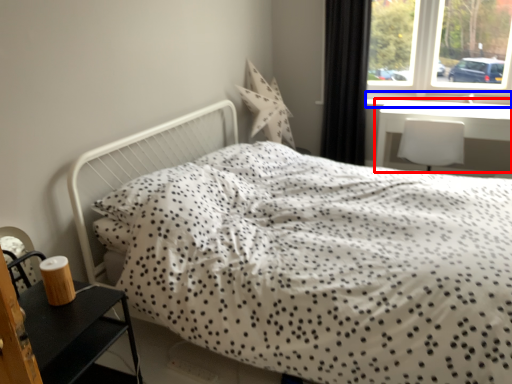
Question: Which point is closer to the camera, table (highlighted by a red box) or window sill (highlighted by a blue box)?

Choices:
 (A) table
 (B) window sill

Answer: (A)